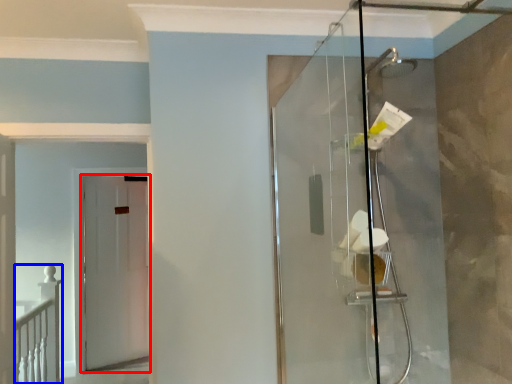
Question: Which object is closer to the camera taking this photo, door (highlighted by a red box) or rail (highlighted by a blue box)?

Choices:
 (A) door
 (B) rail

Answer: (B)